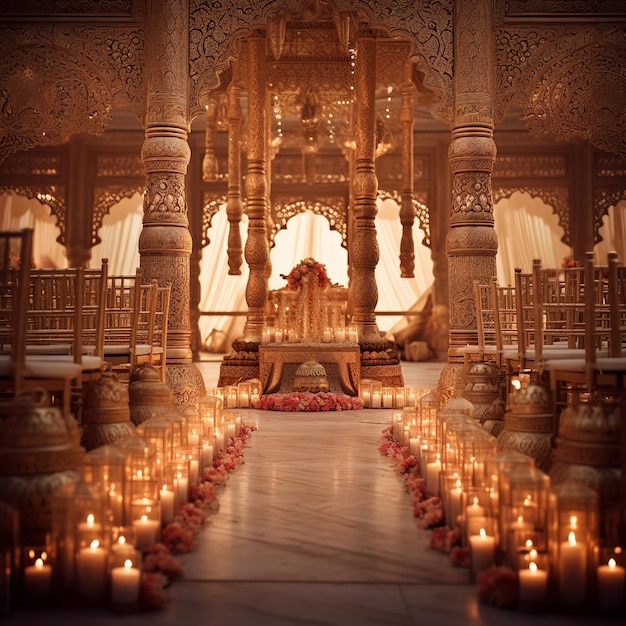
The image size is (626, 626). Find the location of `sheets`. sheets is located at coordinates [292, 244].